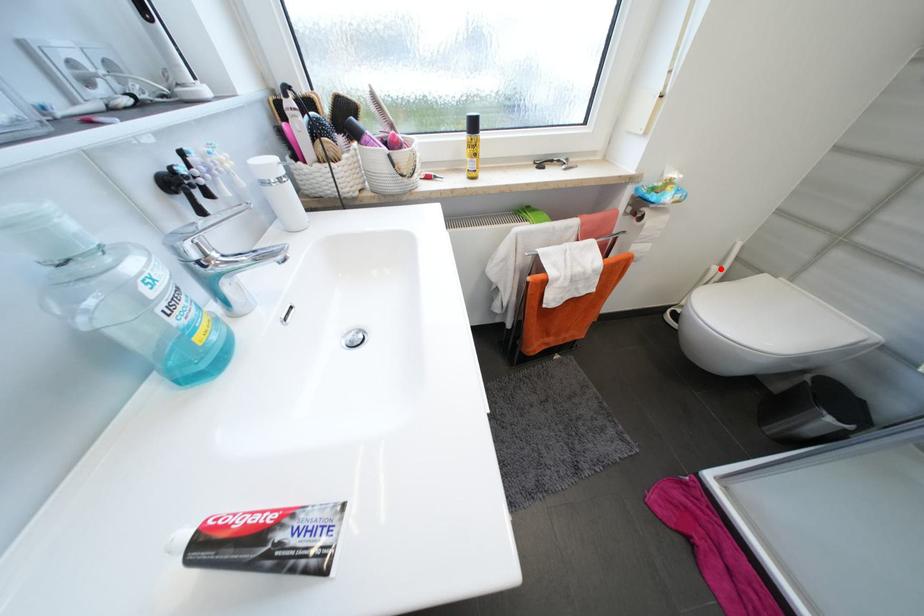
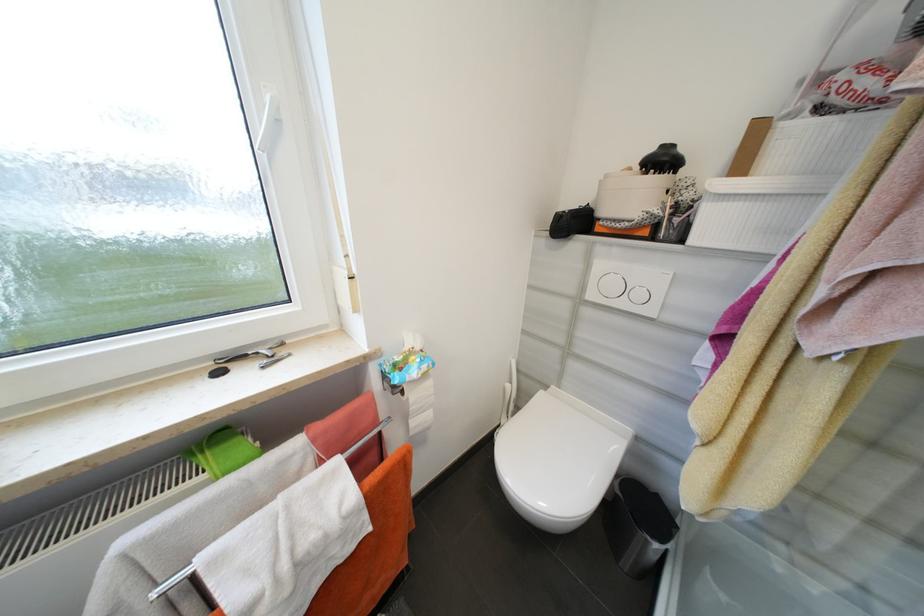
The point at the highlighted location is marked in the first image. Where is the corresponding point in the second image?

(514, 387)